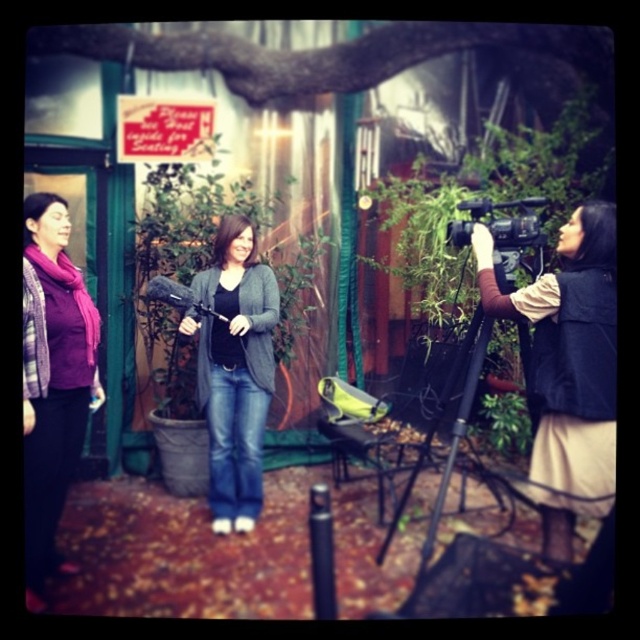
Question: Does matte gray cardigan at center have a lesser width compared to black metal tripod at center?

Choices:
 (A) no
 (B) yes

Answer: (B)

Question: Among these points, which one is nearest to the camera?

Choices:
 (A) (273, 307)
 (B) (49, 474)

Answer: (B)

Question: Which point is closer to the camera?

Choices:
 (A) matte purple scarf at left
 (B) matte gray cardigan at center

Answer: (A)

Question: Is velvet black vest at right to the left of black plastic video camera at center from the viewer's perspective?

Choices:
 (A) no
 (B) yes

Answer: (A)

Question: Based on their relative distances, which object is farther from the matte gray cardigan at center?

Choices:
 (A) matte purple scarf at left
 (B) black plastic video camera at center
 (C) matte black microphone at center
 (D) black metal tripod at center

Answer: (B)

Question: Does matte gray cardigan at center have a smaller size compared to matte black microphone at center?

Choices:
 (A) yes
 (B) no

Answer: (B)